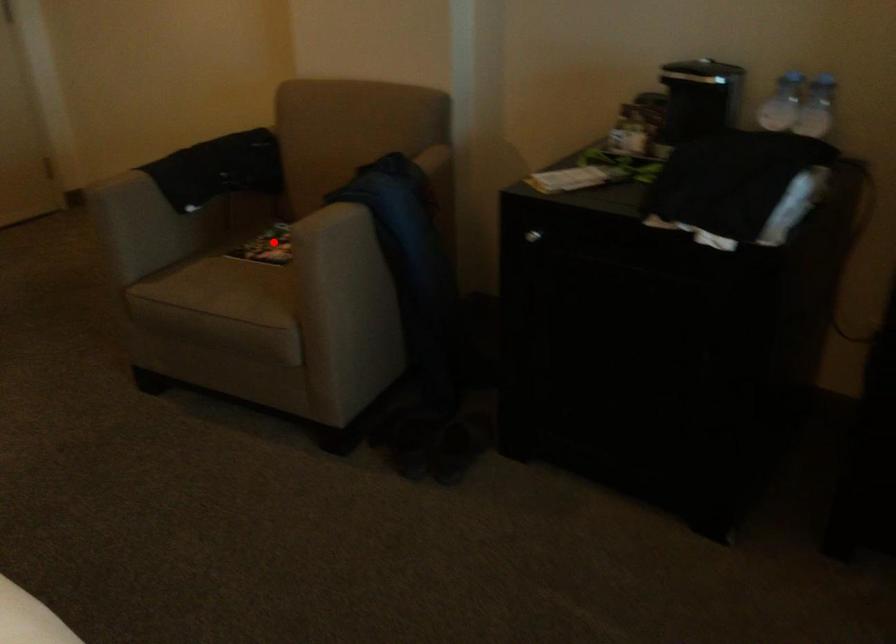
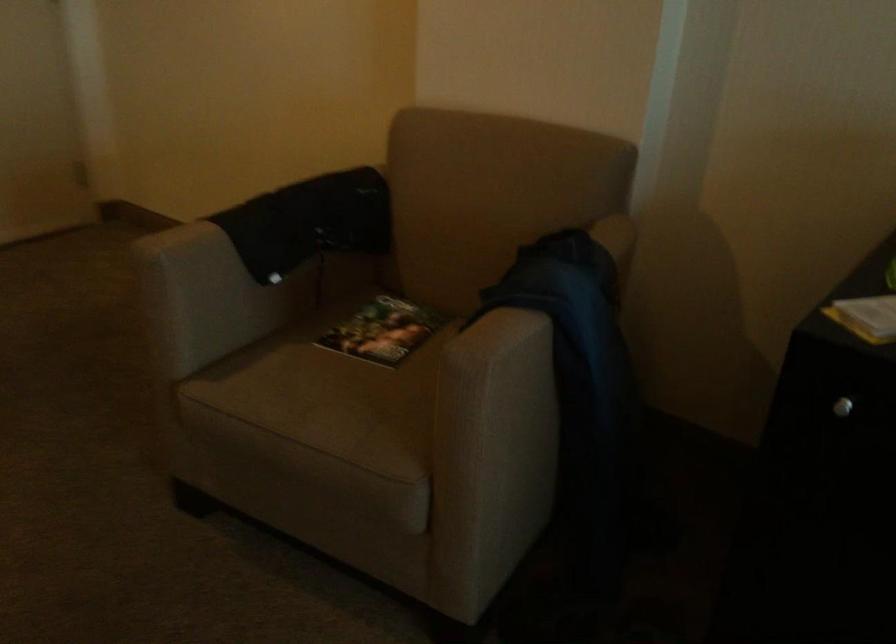
Question: I am providing you with two images of the same scene from different viewpoints. Image1 has a red point marked. In image2, the corresponding 3D location appears at what relative position? Reply with the corresponding letter.

Choices:
 (A) Closer
 (B) Farther

Answer: (A)